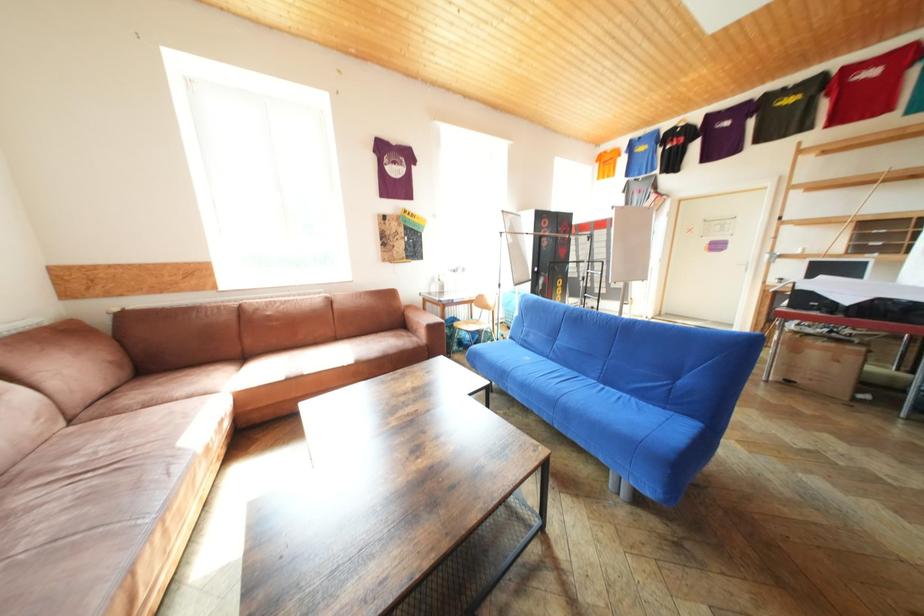
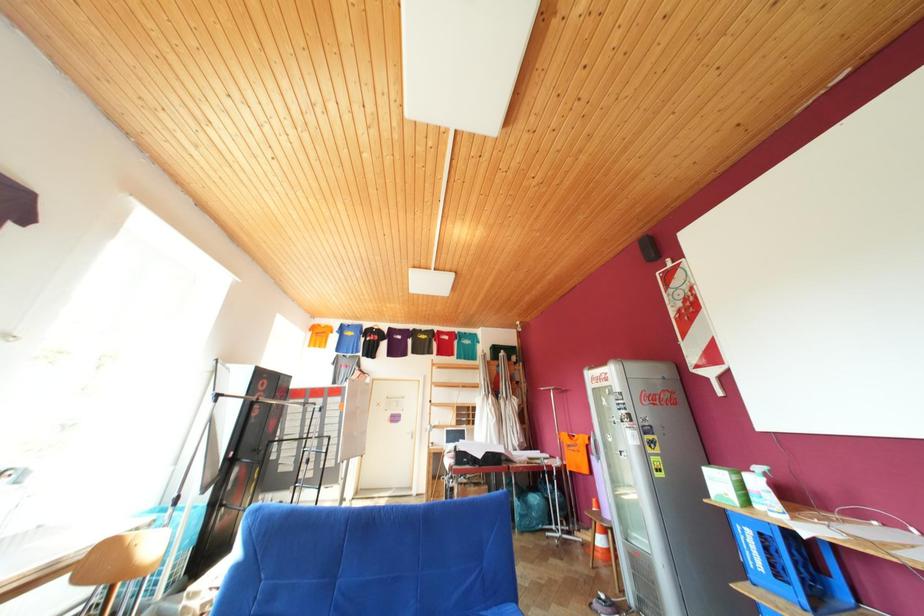
The images are taken continuously from a first-person perspective. In which direction is your viewpoint rotating?

The camera's rotation is toward right-up.